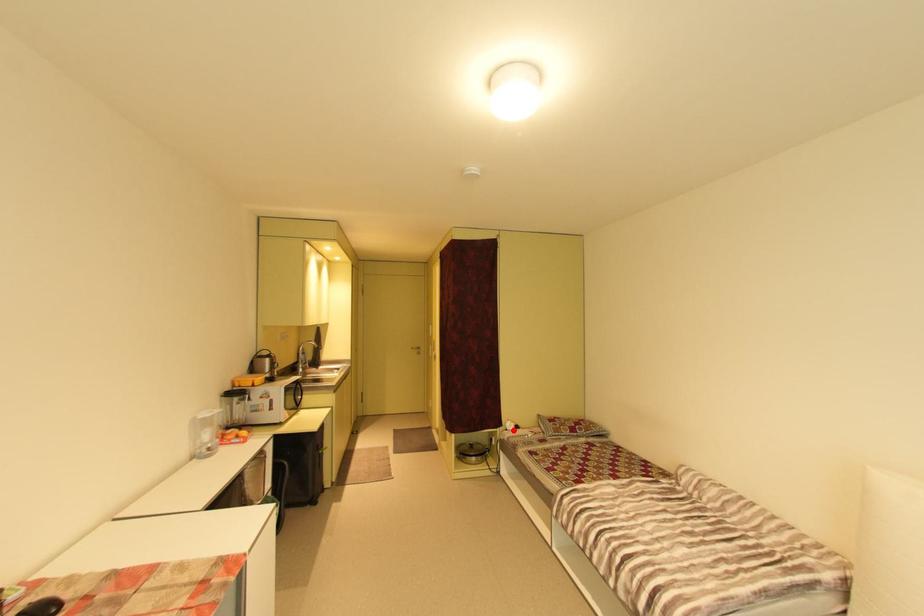
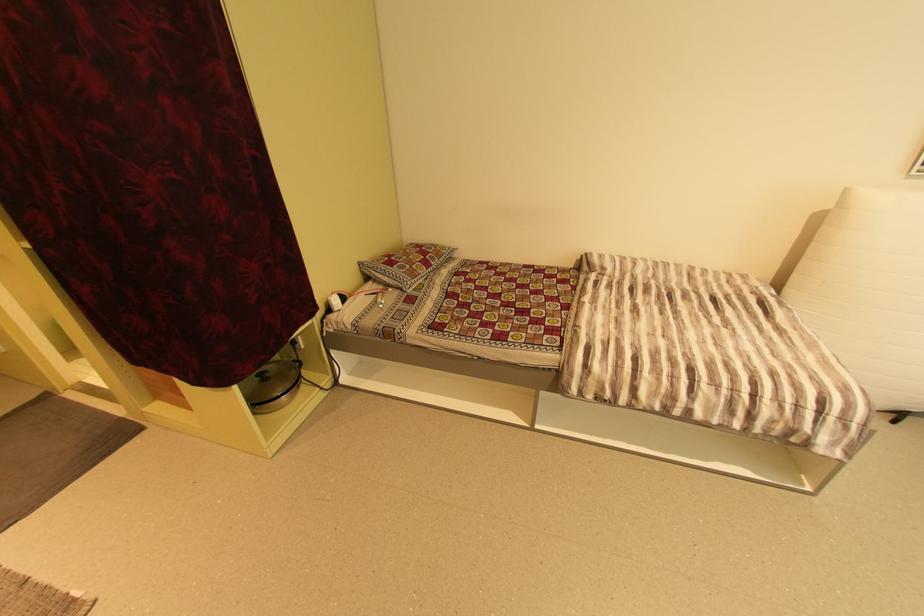
Locate, in the second image, the point that corresponds to the highlighted location in the first image.

(335, 310)